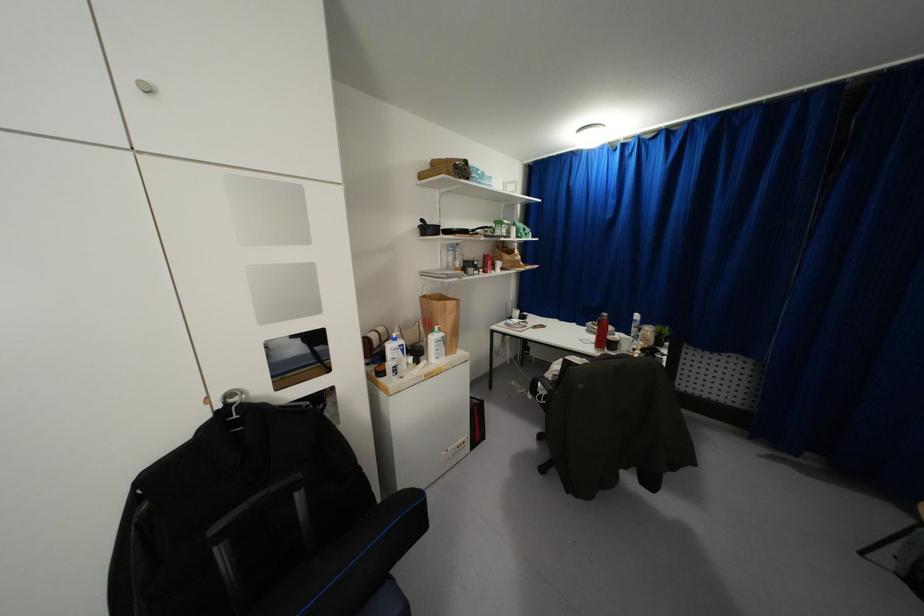
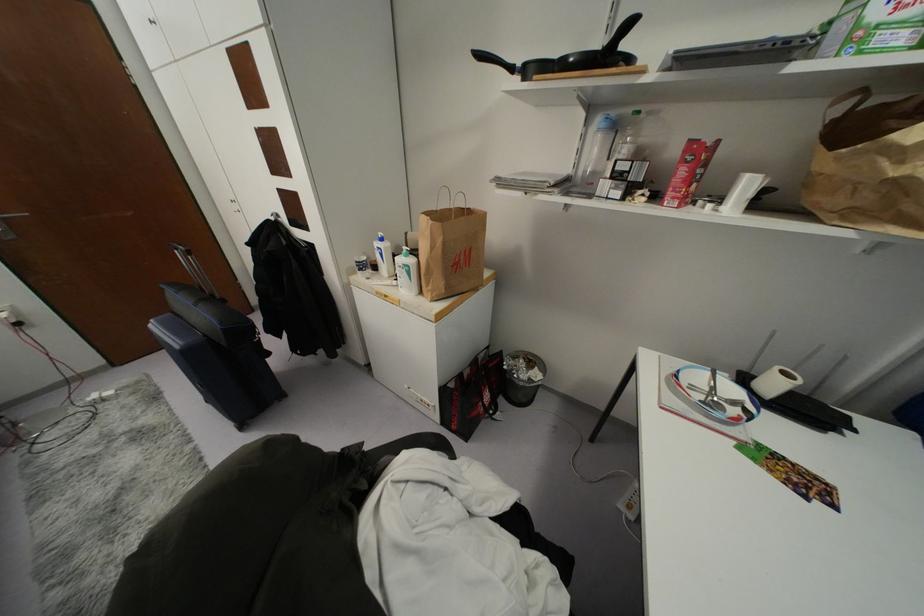
Locate, in the second image, the point that corresponds to [442,333] in the first image.

(410, 261)